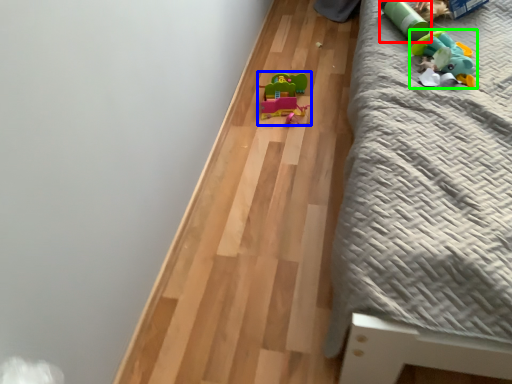
Question: Considering the real-world distances, which object is farthest from toy (highlighted by a red box)? toy (highlighted by a blue box) or toy (highlighted by a green box)?

Choices:
 (A) toy
 (B) toy

Answer: (A)